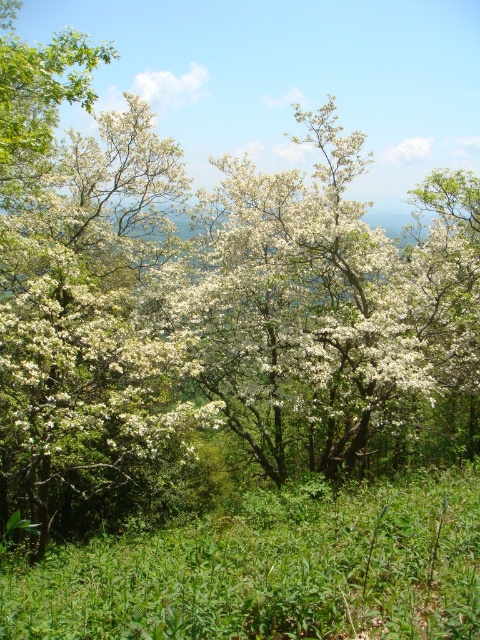
Question: Which of the following is the farthest from the observer?

Choices:
 (A) green leafy grass at center
 (B) white matte flowers at center

Answer: (B)

Question: Can you confirm if white matte flowers at center is bigger than green leafy grass at center?

Choices:
 (A) no
 (B) yes

Answer: (B)

Question: Where is white matte flowers at center located in relation to green leafy grass at center in the image?

Choices:
 (A) above
 (B) below

Answer: (A)

Question: Can you confirm if white matte flowers at center is smaller than green leafy grass at center?

Choices:
 (A) no
 (B) yes

Answer: (A)